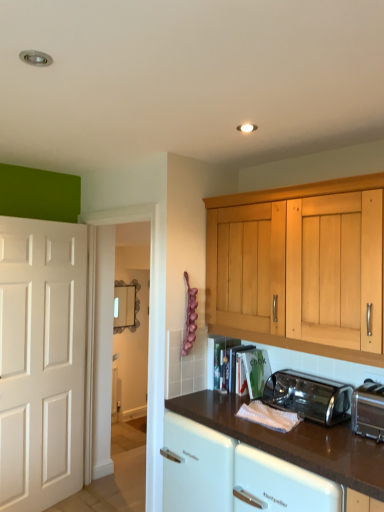
Where is `vacant area that is in front of polished stainless steel toaster at lower center, which is the second toaster from front to back`? This screenshot has width=384, height=512. vacant area that is in front of polished stainless steel toaster at lower center, which is the second toaster from front to back is located at coordinates (318, 437).